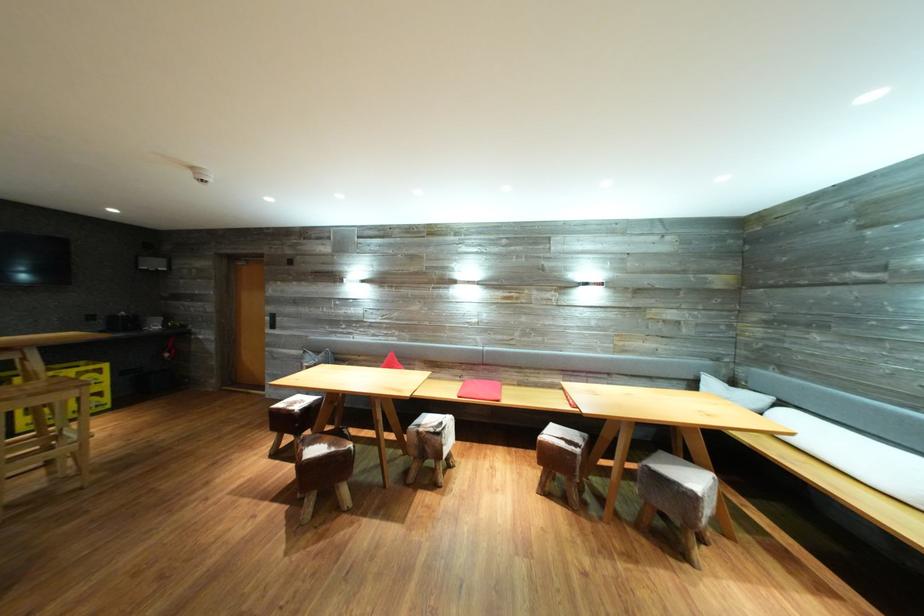
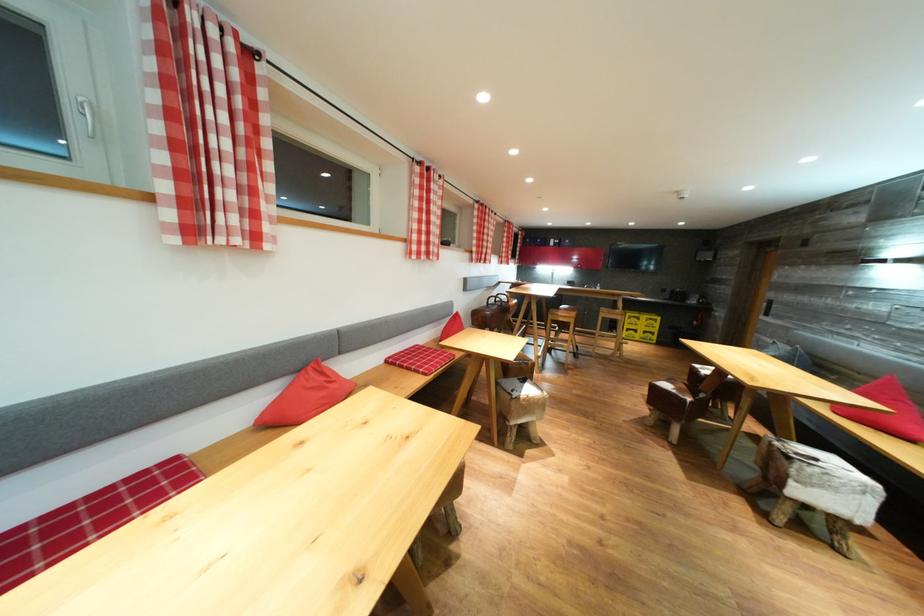
The point at (447, 429) is marked in the first image. Where is the corresponding point in the second image?

(821, 464)